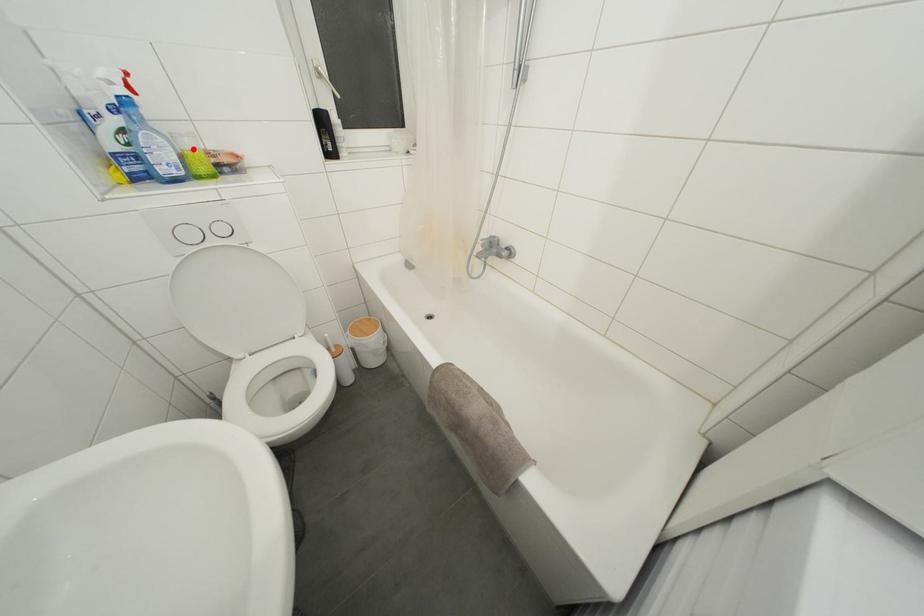
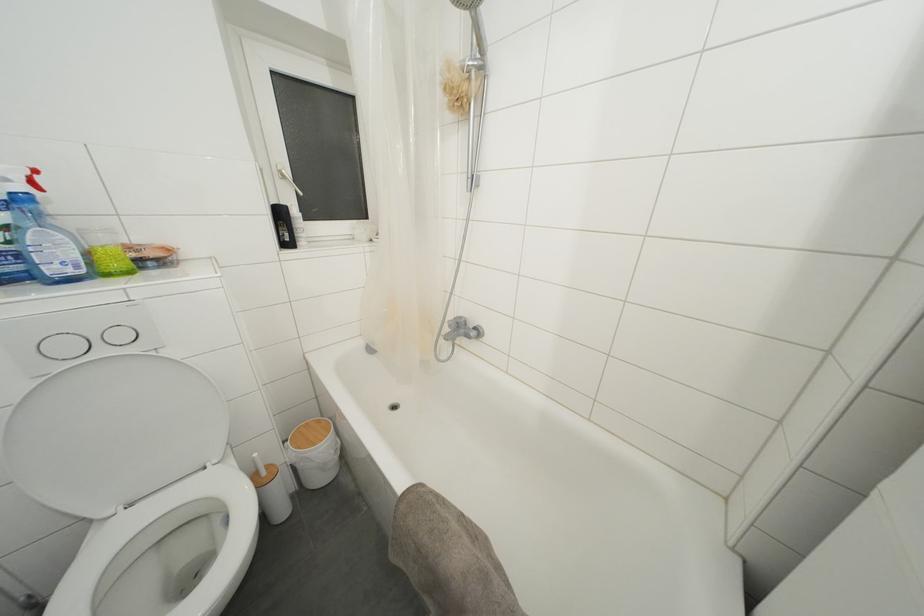
In the second image, find the point that corresponds to the highlighted location in the first image.

(108, 245)